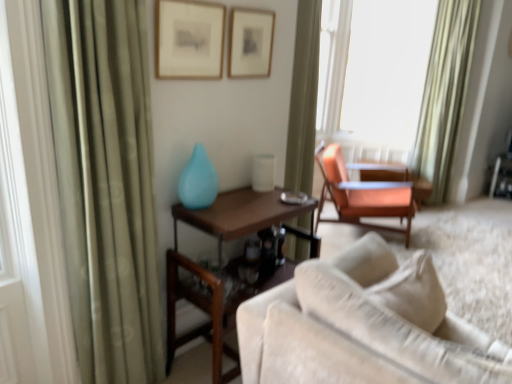
Find the location of a particular element. unoccupied region to the right of matte glass vase at center is located at coordinates (236, 203).